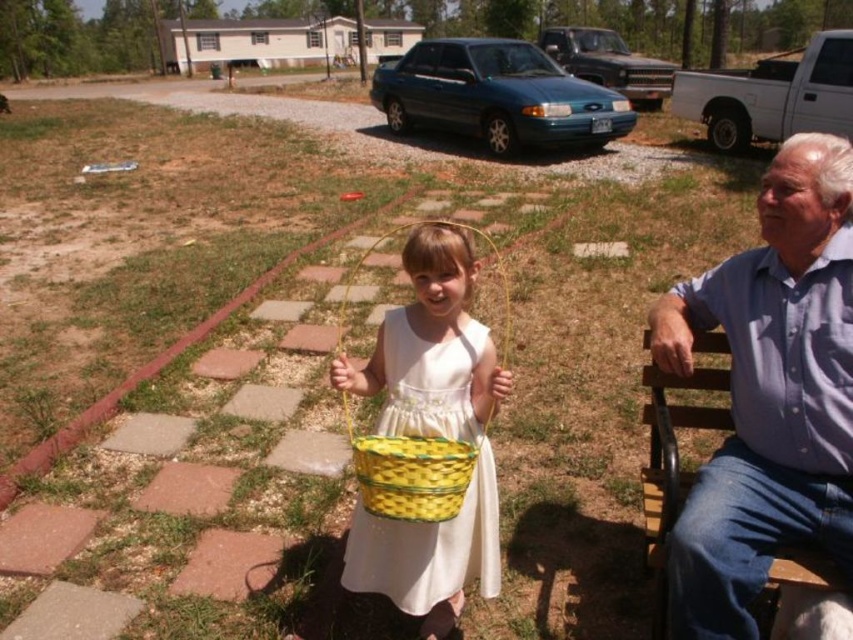
Which is more to the left, blue cotton shirt at right or yellow woven basket at center?

yellow woven basket at center is more to the left.

Measure the distance between point (792, 164) and camera.

A distance of 6.77 feet exists between point (792, 164) and camera.

Locate an element on the screen. blue cotton shirt at right is located at coordinates (769, 394).